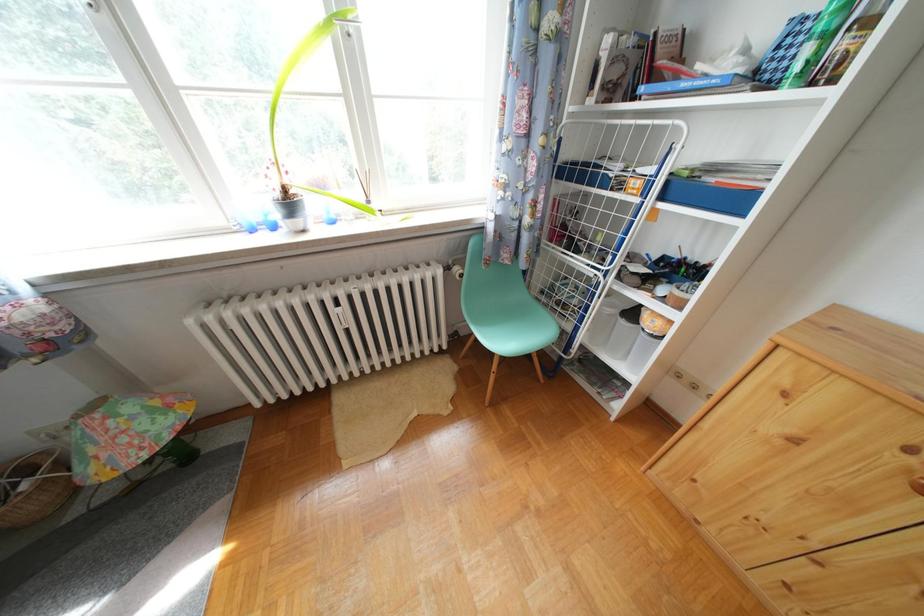
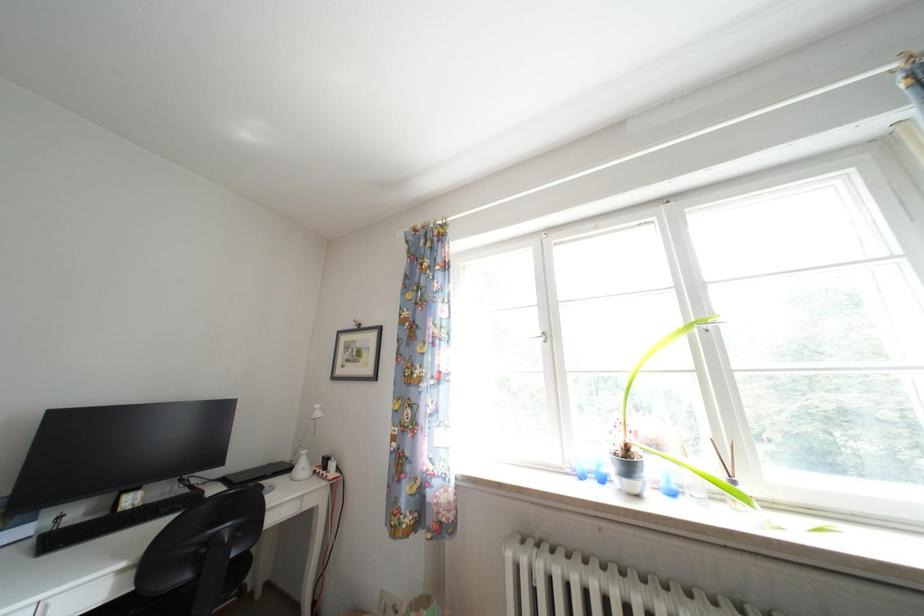
The first image is from the beginning of the video and the second image is from the end. How did the camera likely rotate when shooting the video?

The camera rotated toward left-up.